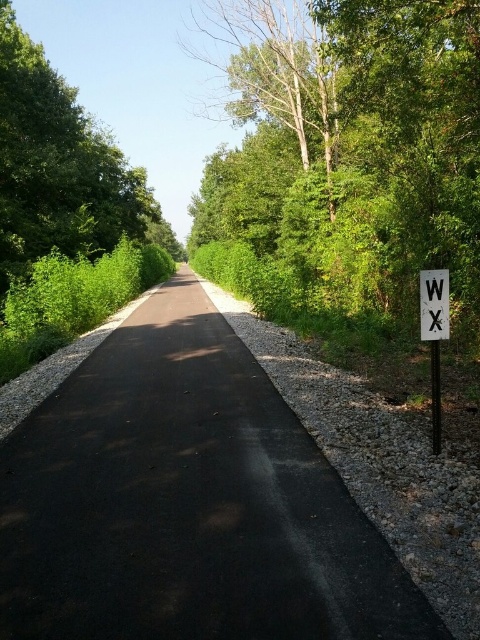
You are a hiker carrying a 2.5 meter long kayak on your back. You want to walk along the black asphalt path at center while avoiding the white plastic sign at right. Is the path wide enough for you to pass safely without hitting the sign?

The distance between the black asphalt path at center and the white plastic sign at right is 3.44 meters. Since the kayak is 2.5 meters long, you can safely pass as the distance is greater than the kayak length.

You are a hiker planning to walk along the black asphalt path at center and want to ensure your backpack won t get caught on the white wooden sign at right. Based on the scene description, can you determine if there is enough space between the path and the sign to safely pass through?

The black asphalt path at center has a larger size compared to the white wooden sign at right, so there should be sufficient space between the path and the sign to safely pass through without the backpack getting caught.

You are standing at the origin point of the image coordinate system and want to walk to the black asphalt path at center. In which direction should you move? Please provide your answer in terms of the coordinate system where the x and y axes are from 0 to 1, with 0 being the bottom left corner and 1 the top right corner.

Since the black asphalt path at center is located at coordinate point (187, 502), you should move towards the right and slightly upward from the origin to reach it.